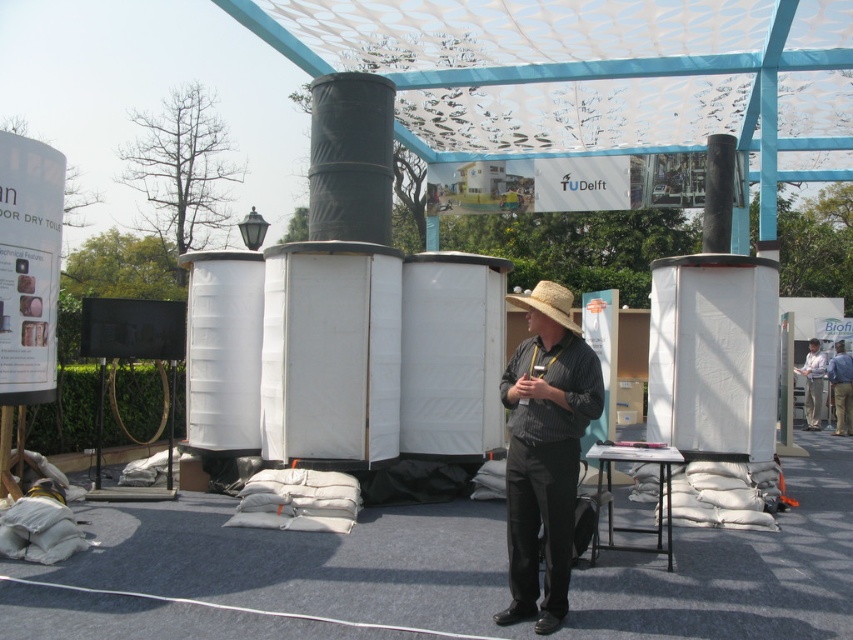
You are standing at the point marked by the coordinates point (548,301) in the image. What object is directly in front of you?

The point (548,301) corresponds to the strawhat at center, so the object directly in front of you is the strawhat at center.

You are standing at the point marked by the coordinates point (508, 381) and want to walk towards the point marked by point (819, 422). Based on the image description, will you be moving towards the canopy structure or away from it?

Since point (508, 381) is in front of point (819, 422), moving from the first point to the second would mean moving away from the canopy structure towards the sandbags and the man in the straw hat.